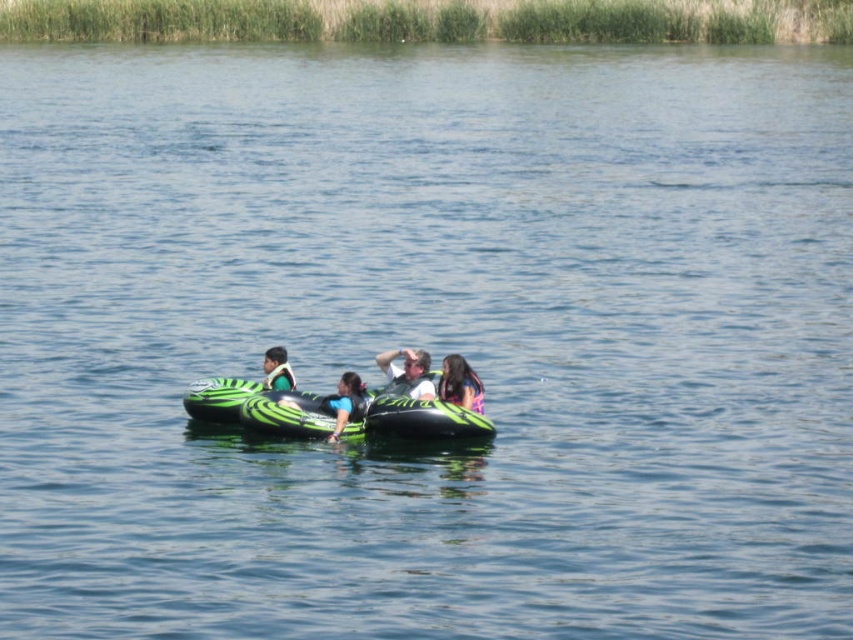
In the scene shown: Does green inflatable tube at center have a greater width compared to matte green life vest at center?

Yes.

Which is behind, point (248, 404) or point (415, 385)?

The point (415, 385) is behind.

The width and height of the screenshot is (853, 640). What are the coordinates of `green inflatable tube at center` in the screenshot? It's located at (253, 406).

Which is more to the left, multicolored fabric hair at center or blue fabric life vest at center?

blue fabric life vest at center

Is point (474, 401) positioned after point (358, 417)?

Yes, it is behind point (358, 417).

This screenshot has width=853, height=640. What are the coordinates of `multicolored fabric hair at center` in the screenshot? It's located at (460, 384).

Can you confirm if green inflatable tube at center is smaller than green rubber tube at center?

Incorrect, green inflatable tube at center is not smaller in size than green rubber tube at center.

Is green inflatable tube at center in front of green rubber tube at center?

Yes.

This screenshot has height=640, width=853. I want to click on green inflatable tube at center, so click(x=253, y=406).